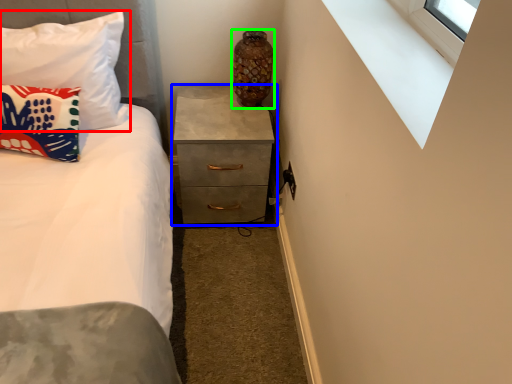
Question: Which object is positioned closest to pillow (highlighted by a red box)? Select from chest of drawers (highlighted by a blue box) and vase (highlighted by a green box).

Choices:
 (A) chest of drawers
 (B) vase

Answer: (A)